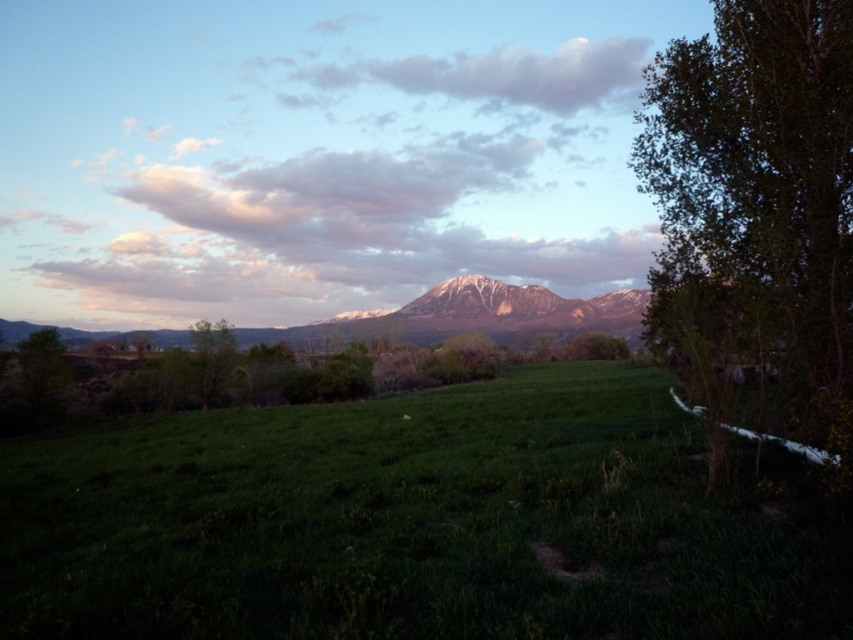
Question: Which of these objects is positioned closest to the green grassy field at center?

Choices:
 (A) green leafy tree at right
 (B) cloudy sky at upper center

Answer: (A)

Question: Observing the image, what is the correct spatial positioning of green grassy field at center in reference to snowy rock mountain at center?

Choices:
 (A) above
 (B) below

Answer: (B)

Question: Considering the real-world distances, which object is closest to the snowy rock mountain at center?

Choices:
 (A) green grassy field at center
 (B) cloudy sky at upper center

Answer: (B)

Question: Does green grassy field at center appear over snowy rock mountain at center?

Choices:
 (A) yes
 (B) no

Answer: (B)

Question: Does green leafy tree at right appear on the right side of cloudy sky at upper center?

Choices:
 (A) yes
 (B) no

Answer: (A)

Question: Which point is closer to the camera taking this photo?

Choices:
 (A) (473, 72)
 (B) (759, 339)

Answer: (B)